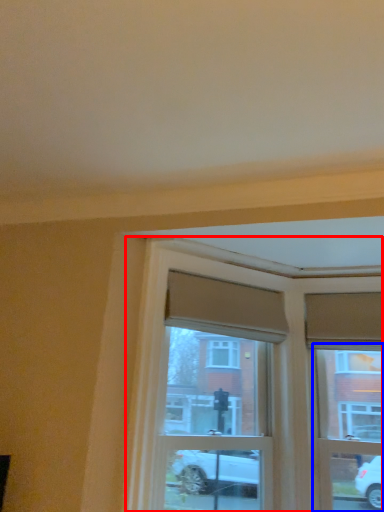
Question: Which of the following is the farthest to the observer, window (highlighted by a red box) or window frame (highlighted by a blue box)?

Choices:
 (A) window
 (B) window frame

Answer: (B)